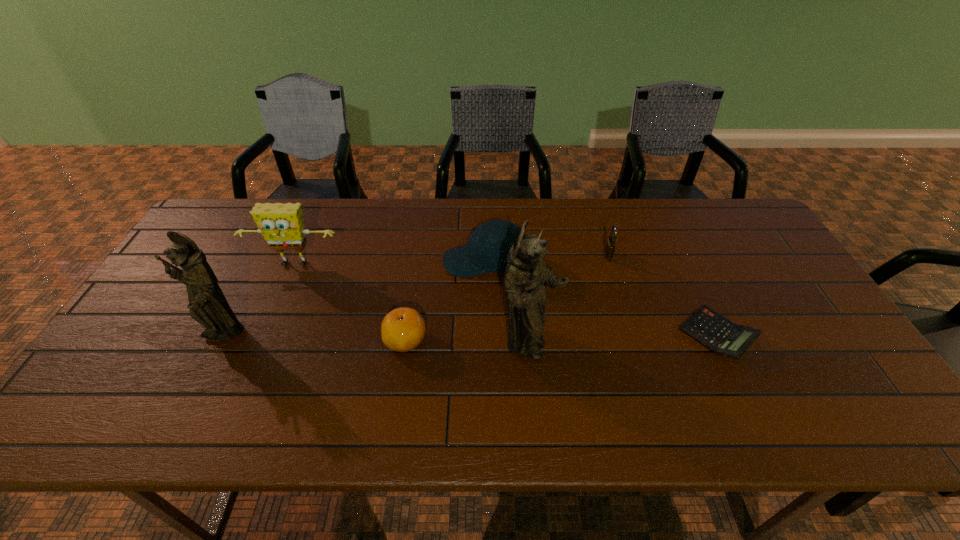
In the current image, all figurines are evenly spaced. To maintain this equal spacing, where should an additional figurine be placed on the right? Please point out a free spot. Please provide its 2D coordinates. Your answer should be formatted as a tuple, i.e. [(x, y)], where the tuple contains the x and y coordinates of a point satisfying the conditions above.

[(851, 356)]